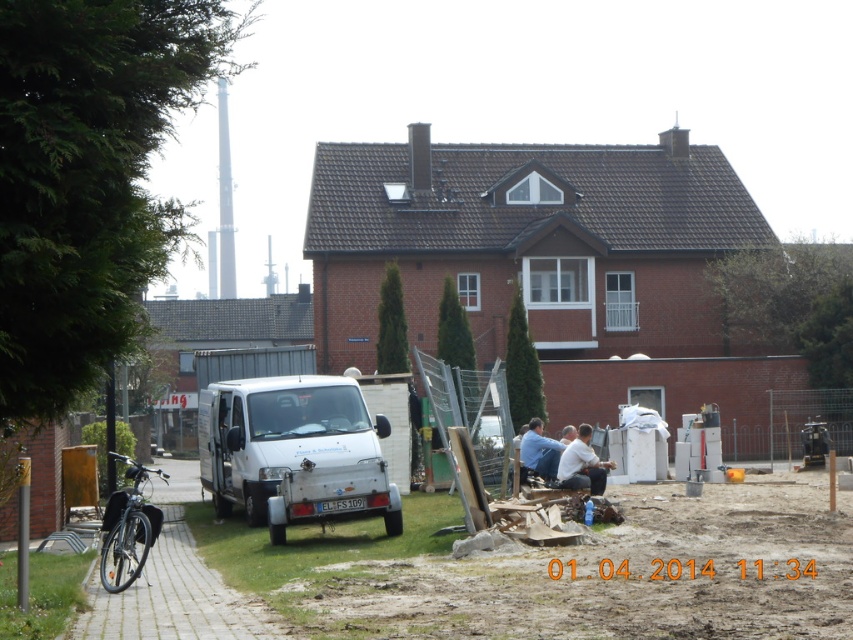
Can you confirm if white matte van at center is smaller than blue fabric shirt at lower center?

No.

Who is more forward, (253, 412) or (548, 458)?

Positioned in front is point (253, 412).

The width and height of the screenshot is (853, 640). I want to click on white matte van at center, so click(x=294, y=452).

Is white matte van at center to the left of light brown leather jacket at lower center from the viewer's perspective?

Indeed, white matte van at center is positioned on the left side of light brown leather jacket at lower center.

What do you see at coordinates (294, 452) in the screenshot? I see `white matte van at center` at bounding box center [294, 452].

Identify the location of white matte van at center. (294, 452).

How much distance is there between light brown leather jacket at lower center and blue fabric shirt at lower center?

3.32 feet

Is point (595, 484) positioned behind point (541, 456)?

No.

Where is `light brown leather jacket at lower center`? This screenshot has width=853, height=640. light brown leather jacket at lower center is located at coordinates (582, 465).